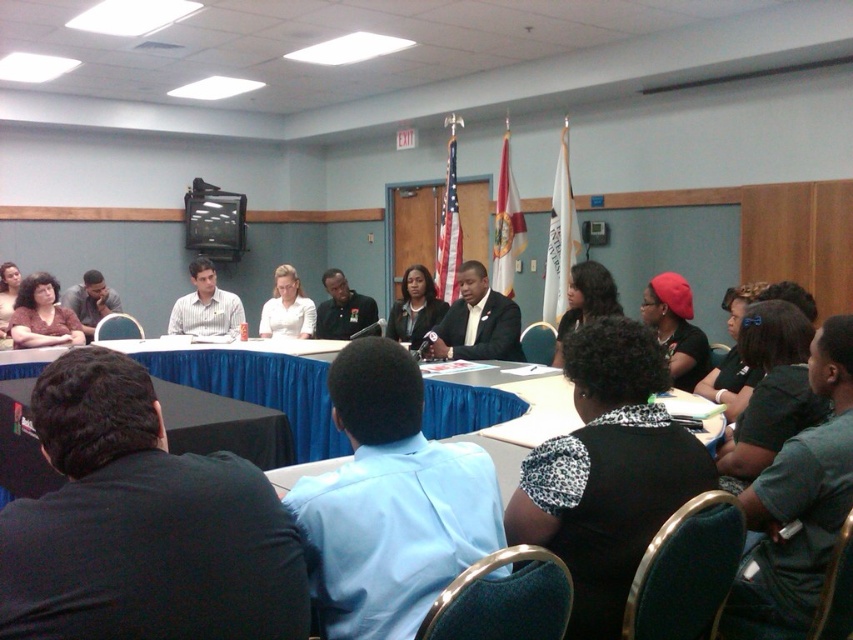
You are organizing a photo shoot for a clothing brand and need to ensure that the black fabric shirt at lower right and the matte black shirt at center are both visible in the frame. Given their sizes, which shirt should you focus on positioning first to ensure it doesn

The black fabric shirt at lower right occupies less space than matte black shirt at center, so you should focus on positioning the matte black shirt at center first since it is larger and may require more careful framing to ensure visibility.

You are attending a professional conference and need to identify the participants based on their clothing. Which participant is seated lower on the table, the one wearing the black fabric shirt at lower right or the matte black shirt at center?

The black fabric shirt at lower right is seated lower on the table than the matte black shirt at center.

You are standing at the camera position and want to walk directly to the point marked at coordinates point (309,316). How far will you have to walk?

The point marked at coordinates point (309,316) is 6.24 meters away from the camera, so you will have to walk 6.24 meters to reach it.